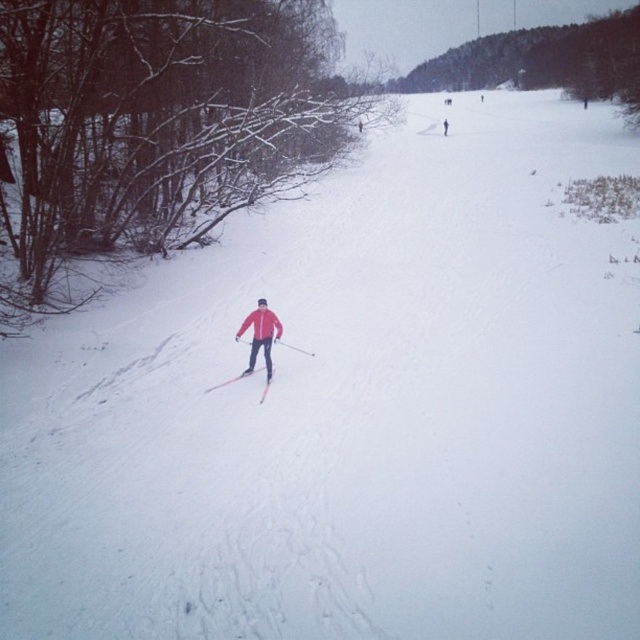
Which is more to the right, shiny metallic ski at center or red jacket skier at center?

Positioned to the right is red jacket skier at center.

Does shiny metallic ski at center lie in front of red jacket skier at center?

That is True.

Measure the distance between point (221, 381) and camera.

Point (221, 381) is 14.06 meters away from camera.

Image resolution: width=640 pixels, height=640 pixels. Find the location of `shiny metallic ski at center`. shiny metallic ski at center is located at coordinates (228, 381).

Measure the distance between green leafy tree at upper center and camera.

green leafy tree at upper center and camera are 66.37 meters apart from each other.

Is green leafy tree at upper center bigger than matte red jacket at center?

Yes.

Is point (612, 44) positioned before point (264, 323)?

No, (612, 44) is behind (264, 323).

Locate an element on the screen. Image resolution: width=640 pixels, height=640 pixels. green leafy tree at upper center is located at coordinates (540, 60).

Between snowy bare branches at left and green leafy tree at upper center, which one appears on the left side from the viewer's perspective?

Positioned to the left is snowy bare branches at left.

Who is positioned more to the right, snowy bare branches at left or green leafy tree at upper center?

Positioned to the right is green leafy tree at upper center.

What do you see at coordinates (154, 131) in the screenshot? I see `snowy bare branches at left` at bounding box center [154, 131].

In order to click on snowy bare branches at left in this screenshot , I will do `click(154, 131)`.